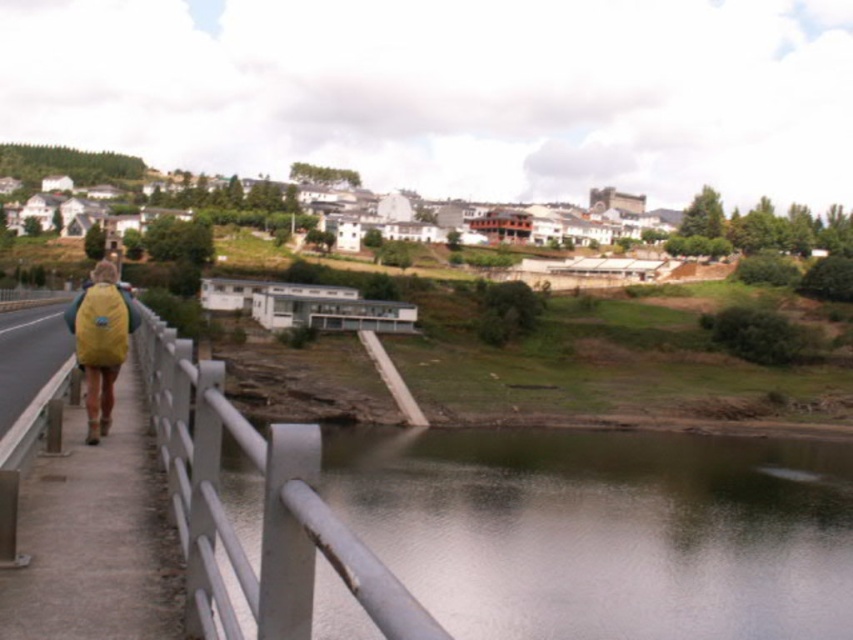
Is greenish reflective water at lower center positioned behind white metallic rail at left?

Yes, greenish reflective water at lower center is behind white metallic rail at left.

Between point (656, 461) and point (287, 522), which one is positioned in front?

Point (287, 522)

I want to click on greenish reflective water at lower center, so click(602, 531).

Is white metallic rail at left to the left of concrete sidewalk at left from the viewer's perspective?

Correct, you'll find white metallic rail at left to the left of concrete sidewalk at left.

Does white metallic rail at left have a larger size compared to concrete sidewalk at left?

Yes.

What do you see at coordinates (262, 508) in the screenshot?
I see `white metallic rail at left` at bounding box center [262, 508].

You are a GUI agent. You are given a task and a screenshot of the screen. Output one action in this format:
    pyautogui.click(x=<x>, y=<y>)
    Task: Click on the white metallic rail at left
    Image resolution: width=853 pixels, height=640 pixels.
    Given the screenshot: What is the action you would take?
    pyautogui.click(x=262, y=508)

Is point (186, 548) behind point (119, 324)?

No, (186, 548) is in front of (119, 324).

Between white metallic rail at left and yellow fabric backpack at left, which one has less height?

Standing shorter between the two is yellow fabric backpack at left.

Identify the location of white metallic rail at left. click(262, 508).

Where is `white metallic rail at left`? white metallic rail at left is located at coordinates (262, 508).